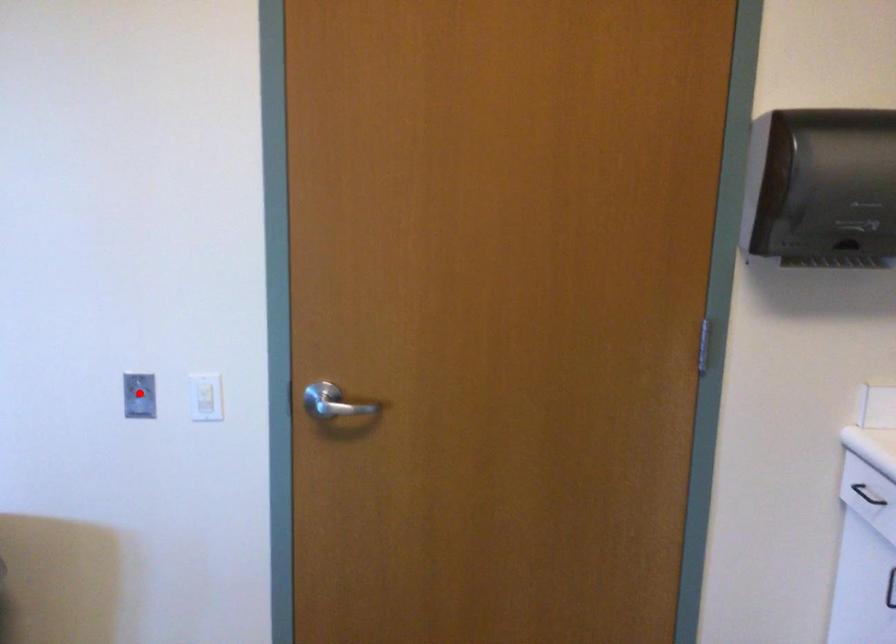
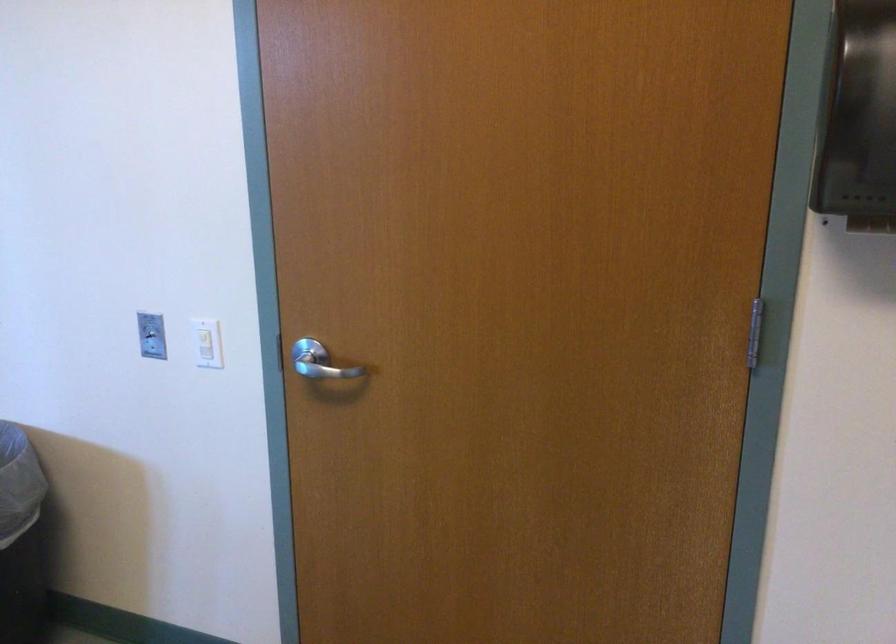
Where in the second image is the point corresponding to the highlighted location from the first image?

(151, 333)